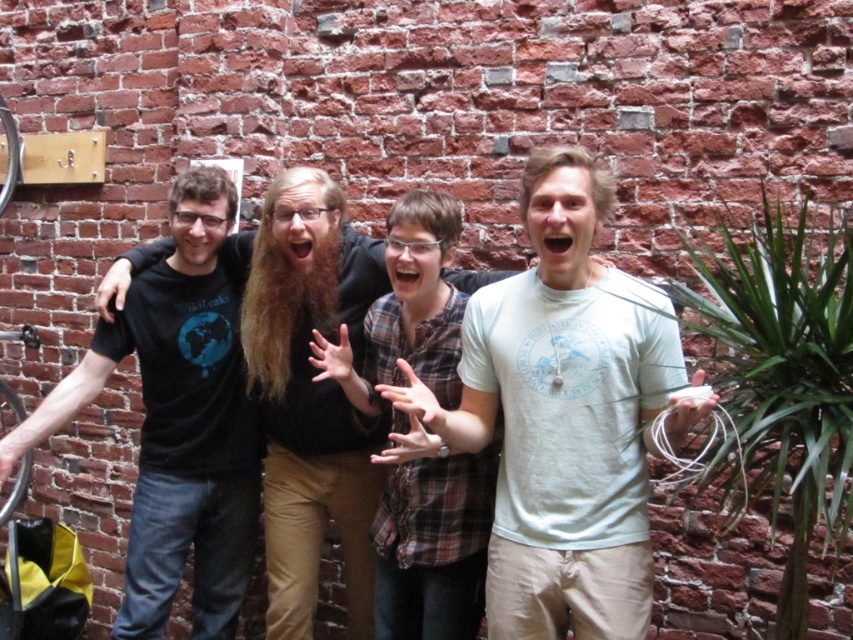
Question: Which point is closer to the camera?

Choices:
 (A) (490, 586)
 (B) (837, 369)

Answer: (B)

Question: Does white cotton t-shirt at center appear on the right side of green leafy plant at right?

Choices:
 (A) yes
 (B) no

Answer: (B)

Question: Does white cotton t-shirt at center have a larger size compared to black matte t-shirt at center?

Choices:
 (A) no
 (B) yes

Answer: (B)

Question: Which object appears farthest from the camera in this image?

Choices:
 (A) black matte t-shirt at left
 (B) black matte t-shirt at center

Answer: (B)

Question: Among these objects, which one is farthest from the camera?

Choices:
 (A) black matte t-shirt at left
 (B) black matte t-shirt at center

Answer: (B)

Question: Is black matte t-shirt at left to the right of black matte t-shirt at center from the viewer's perspective?

Choices:
 (A) yes
 (B) no

Answer: (B)